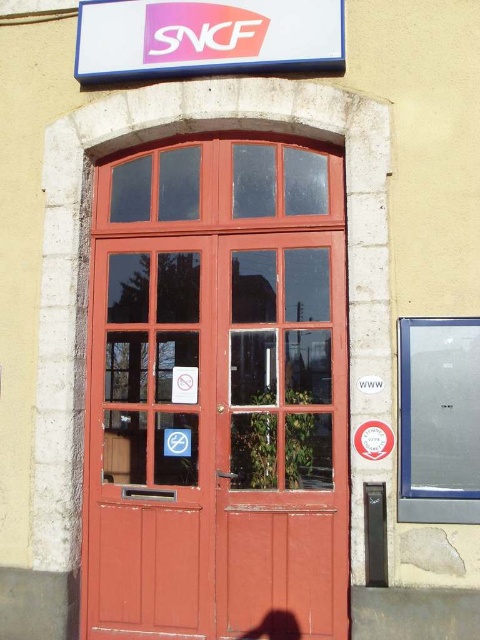
You are a delivery person with a 5 feet long package. You need to enter the building through the entrance shown. Can you fit the package vertically between the smooth wood door at center and the pink plastic sign at upper center?

The smooth wood door at center and the pink plastic sign at upper center are 4.94 feet apart from each other. Since the package is 5 feet long, it is slightly longer than the available space, so it won not fit vertically between them.

You are an architect designing a new building entrance. You want to place a new decorative element between the smooth wood door at center and the pink plastic sign at upper center. Given their sizes, which object should the decorative element be placed closer to?

The decorative element should be placed closer to the smooth wood door at center because its width is less than the pink plastic sign at upper center, so there is more space available next to the wider pink plastic sign.

You are standing in front of the SNCF building entrance and need to enter. There is a smooth wood door at center and a pink plastic sign at upper center. Which object is taller?

The smooth wood door at center is taller than the pink plastic sign at upper center.